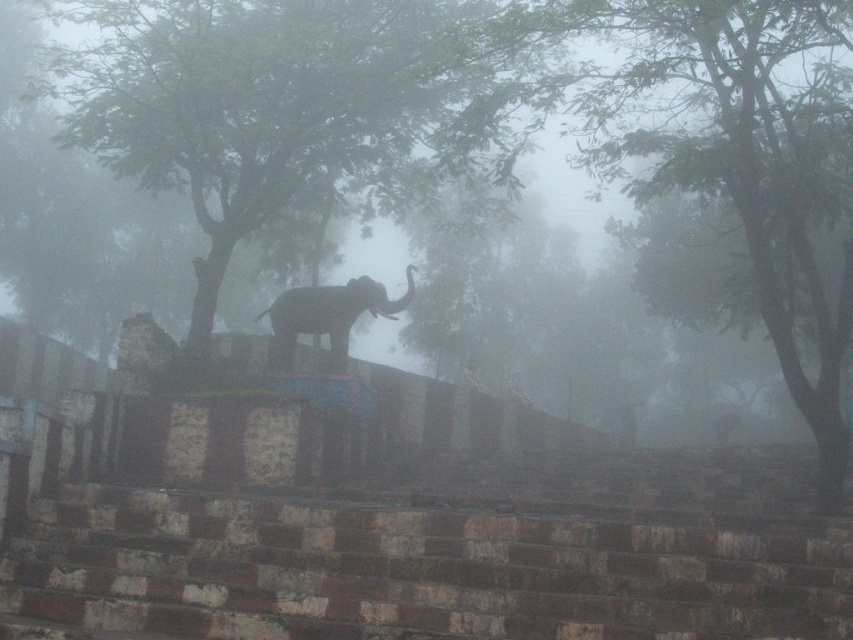
Does green leafy tree at center come behind green leafy tree at upper center?

Yes, it is.

At what (x,y) coordinates should I click in order to perform the action: click on green leafy tree at center. Please return your answer as a coordinate pair (x, y). Looking at the image, I should click on coord(276,100).

Who is shorter, green leafy tree at center or silhouette stone elephant at center?

Standing shorter between the two is silhouette stone elephant at center.

Is green leafy tree at center to the left of silhouette stone elephant at center from the viewer's perspective?

Yes, green leafy tree at center is to the left of silhouette stone elephant at center.

This screenshot has width=853, height=640. In order to click on green leafy tree at center in this screenshot , I will do `click(276, 100)`.

This screenshot has width=853, height=640. Find the location of `green leafy tree at upper center`. green leafy tree at upper center is located at coordinates (695, 145).

The width and height of the screenshot is (853, 640). Describe the element at coordinates (695, 145) in the screenshot. I see `green leafy tree at upper center` at that location.

Find the location of a particular element. This screenshot has height=640, width=853. green leafy tree at upper center is located at coordinates (695, 145).